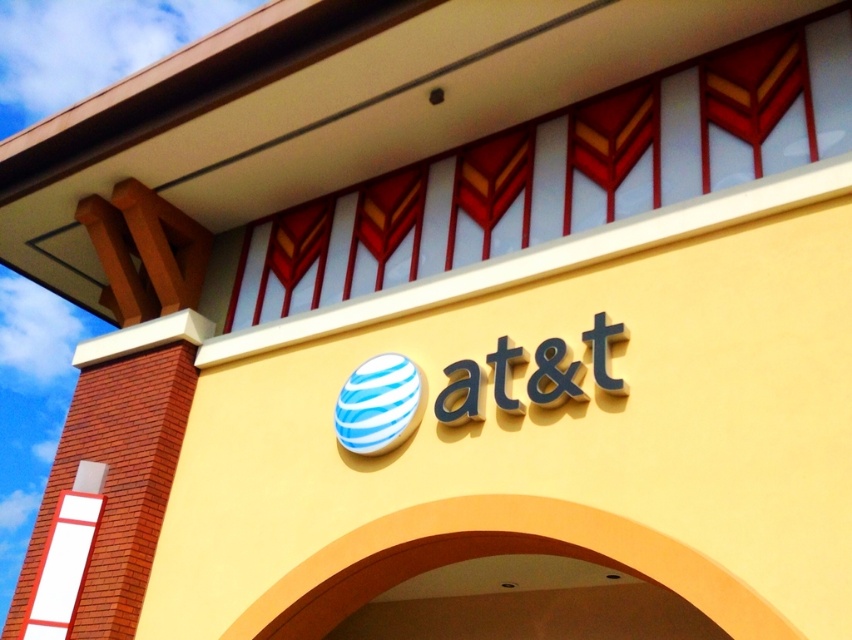
Question: Can you confirm if blue matte sign at center is positioned to the left of blue striped sphere at center?

Choices:
 (A) no
 (B) yes

Answer: (A)

Question: Which point appears closest to the camera in this image?

Choices:
 (A) (419, 403)
 (B) (509, 396)

Answer: (B)

Question: Is blue matte sign at center below blue striped sphere at center?

Choices:
 (A) yes
 (B) no

Answer: (B)

Question: Can you confirm if blue matte sign at center is positioned to the left of blue striped sphere at center?

Choices:
 (A) no
 (B) yes

Answer: (A)